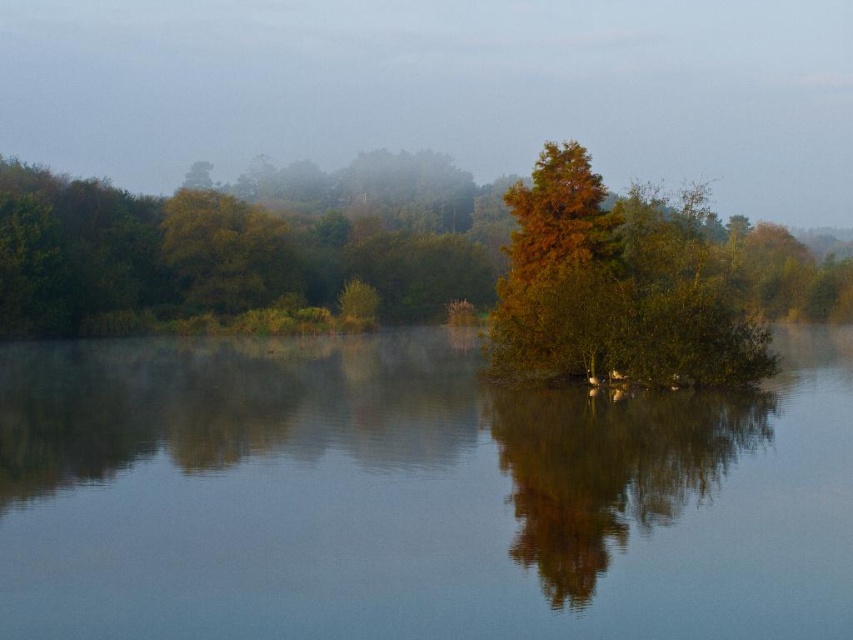
Question: Estimate the real-world distances between objects in this image. Which object is closer to the brown matte tree at center?

Choices:
 (A) orange matte tree at center
 (B) transparent water at center

Answer: (B)

Question: Which point appears closest to the camera in this image?

Choices:
 (A) (86, 433)
 (B) (669, 273)
 (C) (646, 444)

Answer: (C)

Question: Is orange matte tree at center in front of brown matte tree at center?

Choices:
 (A) yes
 (B) no

Answer: (B)

Question: In this image, where is orange matte tree at center located relative to brown matte tree at center?

Choices:
 (A) below
 (B) above

Answer: (B)

Question: Which of these objects is positioned closest to the transparent water at center?

Choices:
 (A) brown matte tree at center
 (B) orange matte tree at center

Answer: (A)

Question: Is transparent water at center thinner than brown matte tree at center?

Choices:
 (A) no
 (B) yes

Answer: (A)